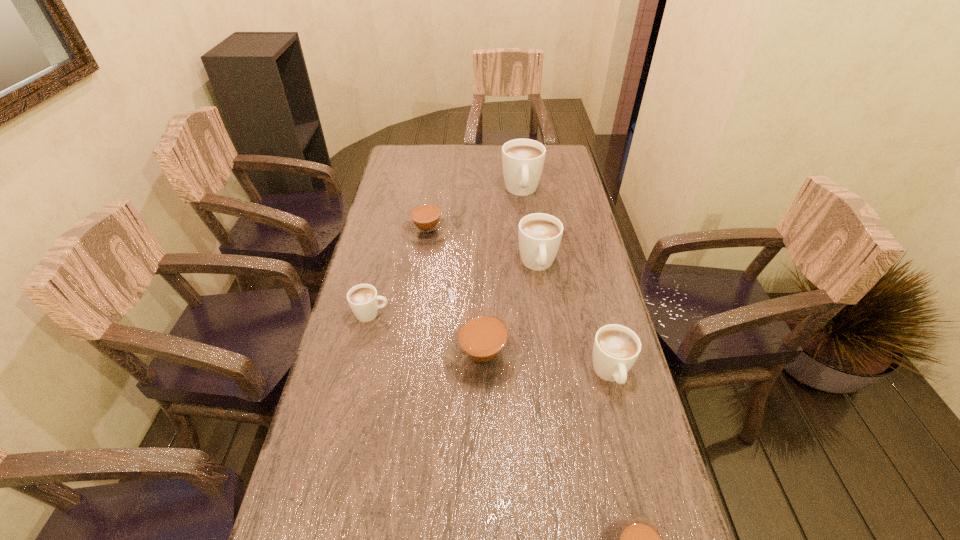
Where is `the tallest cappuccino`? Image resolution: width=960 pixels, height=540 pixels. the tallest cappuccino is located at coordinates (523, 160).

You are a GUI agent. You are given a task and a screenshot of the screen. Output one action in this format:
    pyautogui.click(x=<x>, y=<y>)
    Task: Click on the biggest white cappuccino
    
    Given the screenshot: What is the action you would take?
    pyautogui.click(x=523, y=160)

I want to click on the third smallest white cappuccino, so click(539, 234).

What are the coordinates of `the second tallest object` in the screenshot? It's located at (539, 234).

At what (x,y) coordinates should I click in order to perform the action: click on the biggest brown cappuccino. Please return your answer as a coordinate pair (x, y). Looking at the image, I should click on (482, 351).

At what (x,y) coordinates should I click in order to perform the action: click on the nearest white cappuccino. Please return your answer as a coordinate pair (x, y). Image resolution: width=960 pixels, height=540 pixels. Looking at the image, I should click on (616, 348).

You are a GUI agent. You are given a task and a screenshot of the screen. Output one action in this format:
    pyautogui.click(x=<x>, y=<y>)
    Task: Click on the rightmost white cappuccino
    
    Given the screenshot: What is the action you would take?
    pyautogui.click(x=616, y=348)

You are a GUI agent. You are given a task and a screenshot of the screen. Output one action in this format:
    pyautogui.click(x=<x>, y=<y>)
    Task: Click on the sixth nearest cappuccino
    This screenshot has width=960, height=540.
    Given the screenshot: What is the action you would take?
    pyautogui.click(x=426, y=224)

This screenshot has height=540, width=960. Find the location of `the second smallest brown cappuccino`. the second smallest brown cappuccino is located at coordinates (426, 224).

This screenshot has height=540, width=960. I want to click on the leftmost white cappuccino, so click(363, 299).